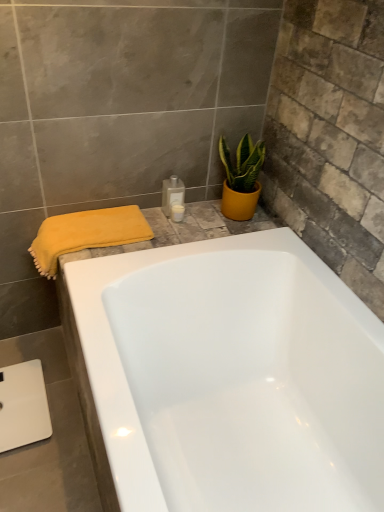
Question: Which direction should I rotate to look at white glossy bottle at upper center, marked as the 1th toiletry in a bottom-to-top arrangement, — up or down?

Choices:
 (A) up
 (B) down

Answer: (A)

Question: From the image's perspective, is translucent plastic bottle at upper center, which is counted as the second toiletry, starting from the bottom, under white glossy bottle at upper center, marked as the 1th toiletry in a bottom-to-top arrangement?

Choices:
 (A) yes
 (B) no

Answer: (B)

Question: Would you say translucent plastic bottle at upper center, which is counted as the second toiletry, starting from the bottom, contains white glossy bottle at upper center, marked as the 1th toiletry in a bottom-to-top arrangement?

Choices:
 (A) yes
 (B) no

Answer: (B)

Question: Does translucent plastic bottle at upper center, the first toiletry from the top, have a greater width compared to white glossy bottle at upper center, marked as the 1th toiletry in a bottom-to-top arrangement?

Choices:
 (A) no
 (B) yes

Answer: (B)

Question: Is the position of translucent plastic bottle at upper center, the first toiletry from the top, more distant than that of white glossy bottle at upper center, acting as the 2th toiletry starting from the top?

Choices:
 (A) no
 (B) yes

Answer: (A)

Question: Is translucent plastic bottle at upper center, the first toiletry from the top, smaller than white glossy bottle at upper center, acting as the 2th toiletry starting from the top?

Choices:
 (A) no
 (B) yes

Answer: (A)

Question: From the image's perspective, is translucent plastic bottle at upper center, which is counted as the second toiletry, starting from the bottom, over white glossy bottle at upper center, acting as the 2th toiletry starting from the top?

Choices:
 (A) yes
 (B) no

Answer: (A)

Question: Is white glossy bottle at upper center, acting as the 2th toiletry starting from the top, bigger than yellow soft towel at left?

Choices:
 (A) yes
 (B) no

Answer: (B)

Question: Is white glossy bottle at upper center, acting as the 2th toiletry starting from the top, positioned with its back to yellow soft towel at left?

Choices:
 (A) no
 (B) yes

Answer: (A)

Question: Is there a large distance between white glossy bottle at upper center, acting as the 2th toiletry starting from the top, and yellow soft towel at left?

Choices:
 (A) no
 (B) yes

Answer: (A)

Question: Can you confirm if white glossy bottle at upper center, marked as the 1th toiletry in a bottom-to-top arrangement, is thinner than yellow soft towel at left?

Choices:
 (A) yes
 (B) no

Answer: (A)

Question: Does white glossy bottle at upper center, marked as the 1th toiletry in a bottom-to-top arrangement, appear on the left side of yellow soft towel at left?

Choices:
 (A) no
 (B) yes

Answer: (A)

Question: Is white glossy bottle at upper center, acting as the 2th toiletry starting from the top, with yellow soft towel at left?

Choices:
 (A) yes
 (B) no

Answer: (B)

Question: Is yellow matte pot at upper right next to translucent plastic bottle at upper center, which is counted as the second toiletry, starting from the bottom?

Choices:
 (A) no
 (B) yes

Answer: (A)